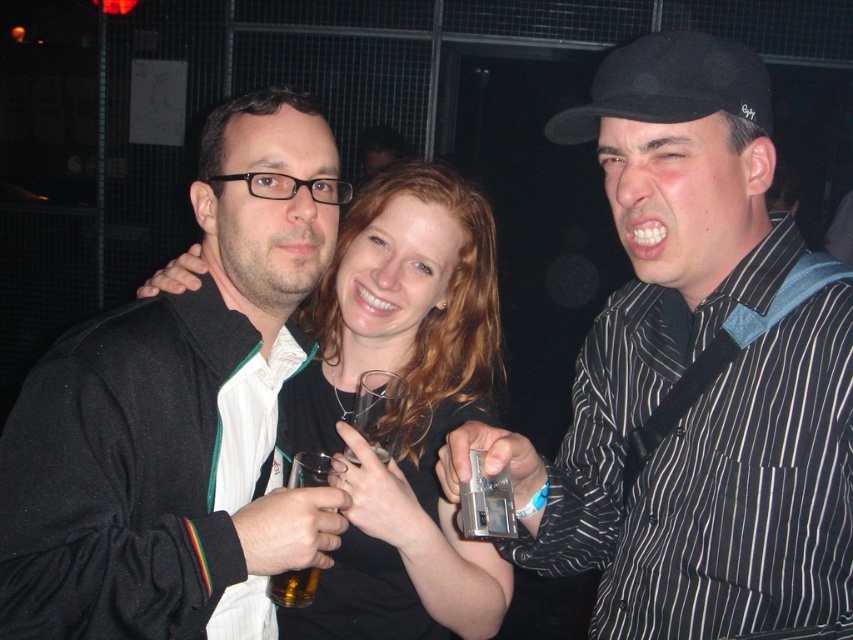
Question: In this image, where is black striped shirt at center located relative to black matte jacket at left?

Choices:
 (A) left
 (B) right

Answer: (B)

Question: Is black matte baseball cap at right thinner than translucent amber glass at center?

Choices:
 (A) yes
 (B) no

Answer: (B)

Question: Which point is farther to the camera?

Choices:
 (A) (112, 529)
 (B) (703, 77)
 (C) (270, 596)

Answer: (C)

Question: Which of the following is the farthest from the observer?

Choices:
 (A) (363, 636)
 (B) (718, 86)
 (C) (572, 492)

Answer: (A)

Question: In this image, where is black striped shirt at center located relative to smooth black dress at center?

Choices:
 (A) above
 (B) below

Answer: (A)

Question: Estimate the real-world distances between objects in this image. Which object is farther from the black striped shirt at center?

Choices:
 (A) black matte baseball cap at right
 (B) black matte jacket at left
 (C) translucent glass beer at center

Answer: (C)